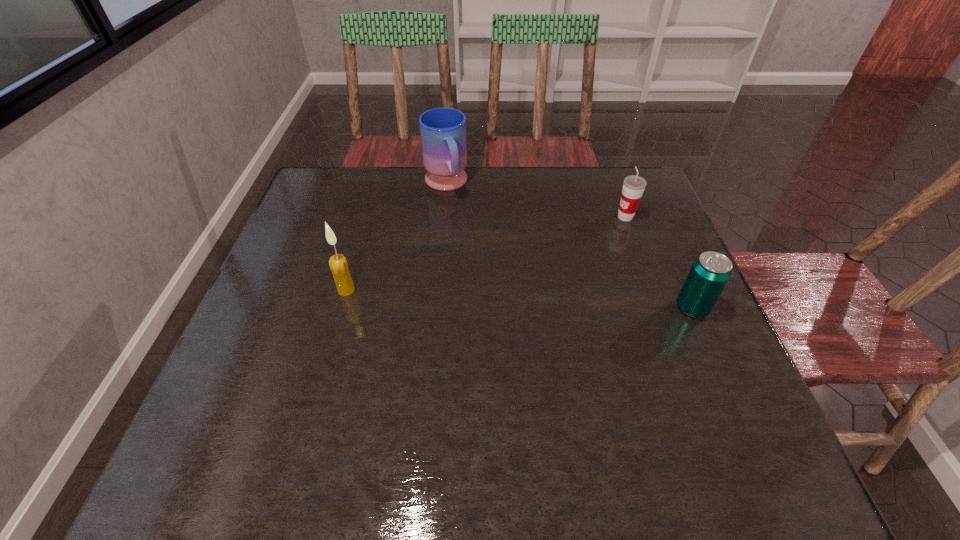
Where is `free space at the near edge of the desktop`? The image size is (960, 540). free space at the near edge of the desktop is located at coordinates (425, 379).

In the image, there is a desktop. Find the location of `vacant region at the left edge`. vacant region at the left edge is located at coordinates (270, 293).

Find the location of a particular element. free space at the right edge of the desktop is located at coordinates (701, 349).

At what (x,y) coordinates should I click in order to perform the action: click on free space at the far left corner of the desktop. Please return your answer as a coordinate pair (x, y). Looking at the image, I should click on (341, 193).

In the image, there is a desktop. Identify the location of vacant space at the far right corner. This screenshot has width=960, height=540. (620, 193).

The width and height of the screenshot is (960, 540). Find the location of `free space at the near right corner of the desktop`. free space at the near right corner of the desktop is located at coordinates (730, 420).

Find the location of `empty space that is in between the beer can and the third nearest object`. empty space that is in between the beer can and the third nearest object is located at coordinates (659, 262).

In order to click on empty location between the rightmost object and the candle in this screenshot , I will do `click(519, 299)`.

Find the location of a particular element. This screenshot has width=960, height=540. vacant point located between the leftmost object and the second object from right to left is located at coordinates (486, 253).

The image size is (960, 540). Identify the location of free point between the rightmost object and the third object from right to left. (569, 246).